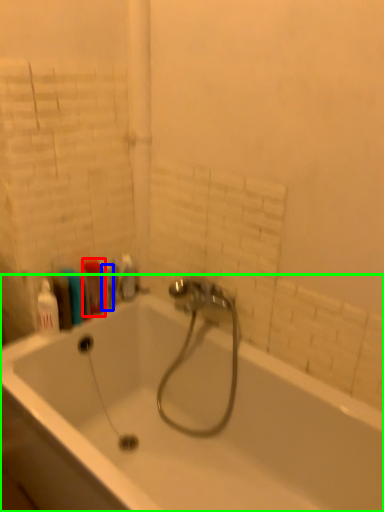
Question: Based on their relative distances, which object is nearer to cleaning product (highlighted by a red box)? Choose from toiletry (highlighted by a blue box) and bathtub (highlighted by a green box).

Choices:
 (A) toiletry
 (B) bathtub

Answer: (A)